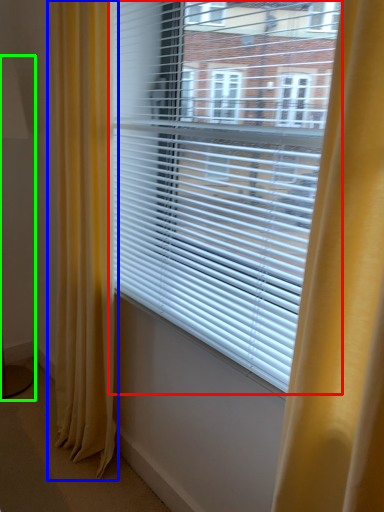
Question: Estimate the real-world distances between objects in this image. Which object is closer to window blind (highlighted by a red box), curtain (highlighted by a blue box) or table lamp (highlighted by a green box)?

Choices:
 (A) curtain
 (B) table lamp

Answer: (A)